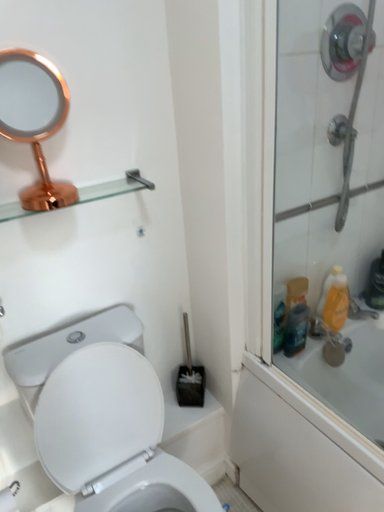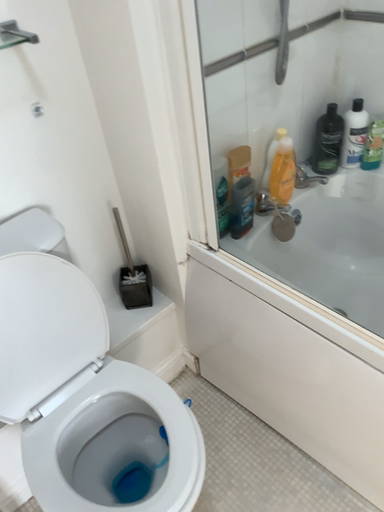
Question: How did the camera likely rotate when shooting the video?

Choices:
 (A) rotated right
 (B) rotated left

Answer: (A)